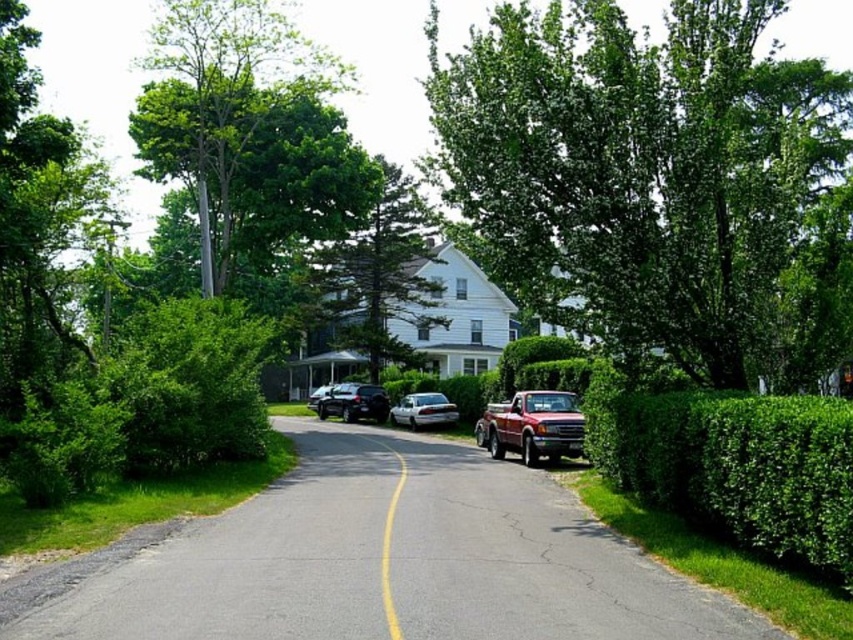
Question: Which point is closer to the camera?

Choices:
 (A) (575, 406)
 (B) (561, 504)
 (C) (376, 406)

Answer: (B)

Question: Is satin black suv at center smaller than white glossy sedan at center?

Choices:
 (A) no
 (B) yes

Answer: (B)

Question: Estimate the real-world distances between objects in this image. Which object is farther from the green leafy hedge at right?

Choices:
 (A) green leafy tree at upper right
 (B) white glossy sedan at center

Answer: (B)

Question: Does smooth asphalt driveway at center appear over metallic red truck at center?

Choices:
 (A) yes
 (B) no

Answer: (B)

Question: Which of the following is the closest to the observer?

Choices:
 (A) green leafy tree at center
 (B) green leafy hedge at right
 (C) white glossy sedan at center

Answer: (B)

Question: Does green leafy tree at center have a larger size compared to shiny silver sedan at center?

Choices:
 (A) yes
 (B) no

Answer: (A)